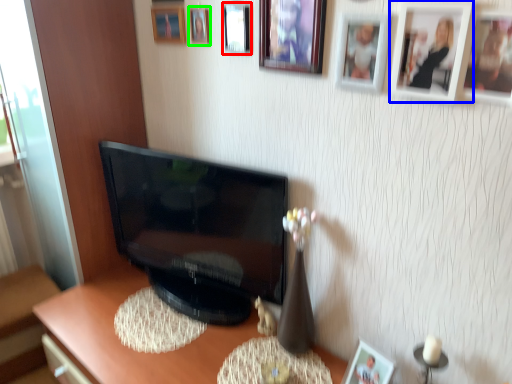
Question: Which object is the farthest from picture frame (highlighted by a red box)? Choose among these: picture frame (highlighted by a blue box) or picture frame (highlighted by a green box).

Choices:
 (A) picture frame
 (B) picture frame

Answer: (A)